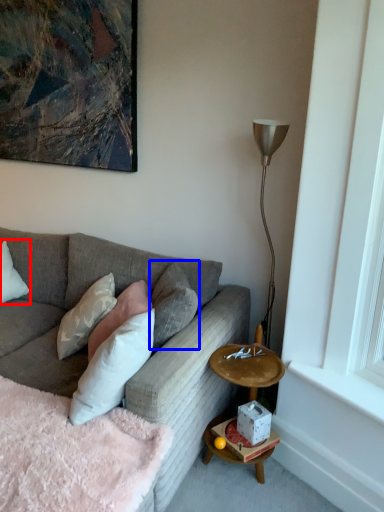
Question: Which object is closer to the camera taking this photo, pillow (highlighted by a red box) or pillow (highlighted by a blue box)?

Choices:
 (A) pillow
 (B) pillow

Answer: (B)